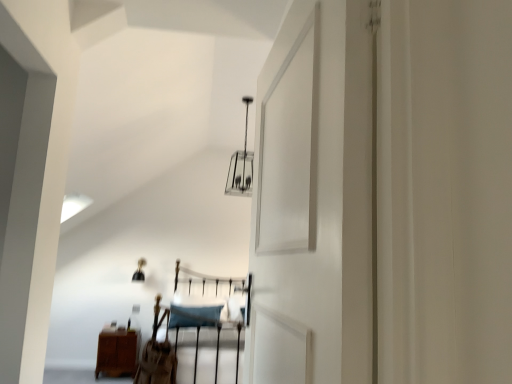
Question: Should I look upward or downward to see brown leather chair at center?

Choices:
 (A) up
 (B) down

Answer: (B)

Question: Can you confirm if brown wood nightstand at lower left is shorter than brown leather chair at center?

Choices:
 (A) yes
 (B) no

Answer: (A)

Question: Is brown wood nightstand at lower left to the left of brown leather chair at center from the viewer's perspective?

Choices:
 (A) no
 (B) yes

Answer: (B)

Question: Could you tell me if brown wood nightstand at lower left is turned towards brown leather chair at center?

Choices:
 (A) yes
 (B) no

Answer: (A)

Question: Is brown wood nightstand at lower left bigger than brown leather chair at center?

Choices:
 (A) no
 (B) yes

Answer: (B)

Question: Considering the relative sizes of brown wood nightstand at lower left and brown leather chair at center in the image provided, is brown wood nightstand at lower left wider than brown leather chair at center?

Choices:
 (A) yes
 (B) no

Answer: (A)

Question: Is there a large distance between brown wood nightstand at lower left and brown leather chair at center?

Choices:
 (A) no
 (B) yes

Answer: (B)

Question: Is metallic silver light fixture at upper center positioned before brown wood nightstand at lower left?

Choices:
 (A) no
 (B) yes

Answer: (B)

Question: Is metallic silver light fixture at upper center touching brown wood nightstand at lower left?

Choices:
 (A) no
 (B) yes

Answer: (A)

Question: Is metallic silver light fixture at upper center wider than brown wood nightstand at lower left?

Choices:
 (A) no
 (B) yes

Answer: (B)

Question: From the image's perspective, is metallic silver light fixture at upper center located beneath brown wood nightstand at lower left?

Choices:
 (A) no
 (B) yes

Answer: (A)

Question: Can you confirm if metallic silver light fixture at upper center is thinner than brown wood nightstand at lower left?

Choices:
 (A) yes
 (B) no

Answer: (B)

Question: Is metallic silver light fixture at upper center taller than brown wood nightstand at lower left?

Choices:
 (A) no
 (B) yes

Answer: (B)

Question: Is brown wood nightstand at lower left touching metallic silver light fixture at upper center?

Choices:
 (A) yes
 (B) no

Answer: (B)